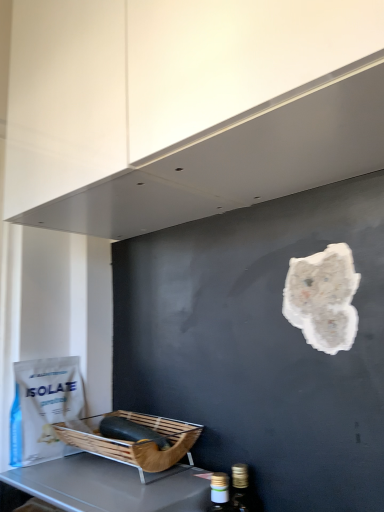
Question: Does wooden basket at lower left have a larger size compared to white matte paper bag at lower left?

Choices:
 (A) yes
 (B) no

Answer: (A)

Question: Can you confirm if wooden basket at lower left is taller than white matte paper bag at lower left?

Choices:
 (A) no
 (B) yes

Answer: (A)

Question: From a real-world perspective, is wooden basket at lower left over white matte paper bag at lower left?

Choices:
 (A) no
 (B) yes

Answer: (A)

Question: Considering the relative positions of wooden basket at lower left and white matte paper bag at lower left in the image provided, is wooden basket at lower left in front of white matte paper bag at lower left?

Choices:
 (A) no
 (B) yes

Answer: (B)

Question: Is wooden basket at lower left placed right next to white matte paper bag at lower left?

Choices:
 (A) yes
 (B) no

Answer: (B)

Question: Is wooden basket at lower left smaller than white matte paper bag at lower left?

Choices:
 (A) yes
 (B) no

Answer: (B)

Question: Can you confirm if brown woven basket at lower left is smaller than white matte exhaust hood at upper center?

Choices:
 (A) no
 (B) yes

Answer: (B)

Question: Is brown woven basket at lower left positioned behind white matte exhaust hood at upper center?

Choices:
 (A) no
 (B) yes

Answer: (B)

Question: Considering the relative sizes of brown woven basket at lower left and white matte exhaust hood at upper center in the image provided, is brown woven basket at lower left thinner than white matte exhaust hood at upper center?

Choices:
 (A) no
 (B) yes

Answer: (B)

Question: Considering the relative sizes of brown woven basket at lower left and white matte exhaust hood at upper center in the image provided, is brown woven basket at lower left shorter than white matte exhaust hood at upper center?

Choices:
 (A) no
 (B) yes

Answer: (B)

Question: From a real-world perspective, is brown woven basket at lower left under white matte exhaust hood at upper center?

Choices:
 (A) yes
 (B) no

Answer: (A)

Question: Is brown woven basket at lower left closer to the viewer compared to white matte exhaust hood at upper center?

Choices:
 (A) yes
 (B) no

Answer: (B)

Question: From a real-world perspective, does brown woven basket at lower left sit lower than white matte paper bag at lower left?

Choices:
 (A) no
 (B) yes

Answer: (B)